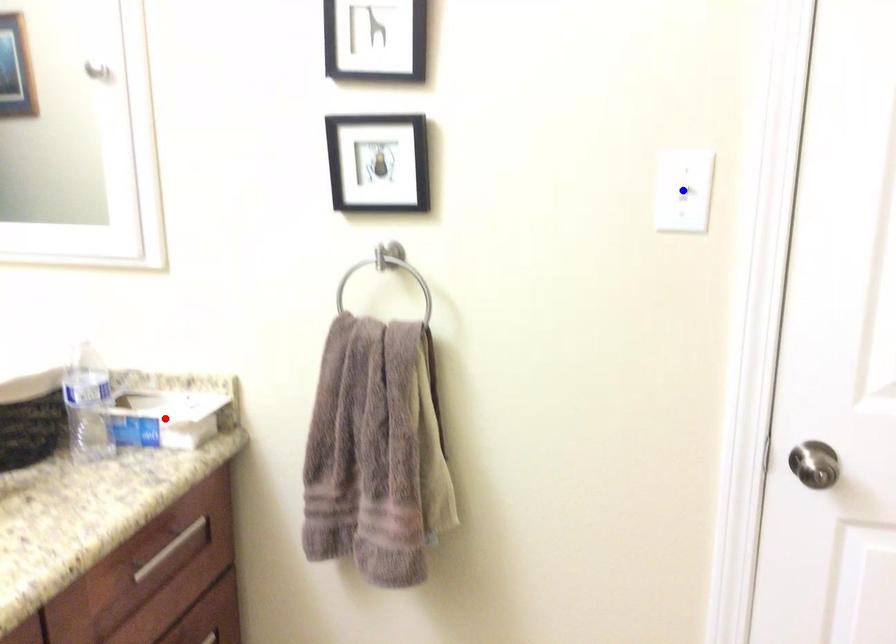
Question: Which of the two points in the image is closer to the camera?

Choices:
 (A) Blue point is closer.
 (B) Red point is closer.

Answer: (A)